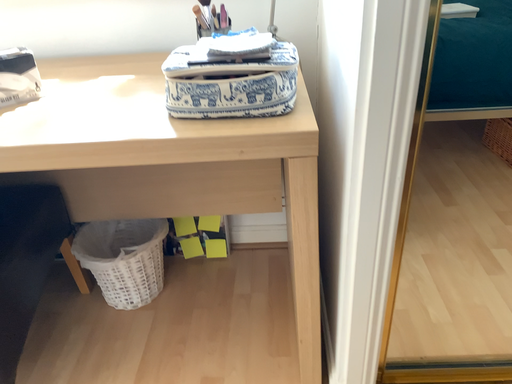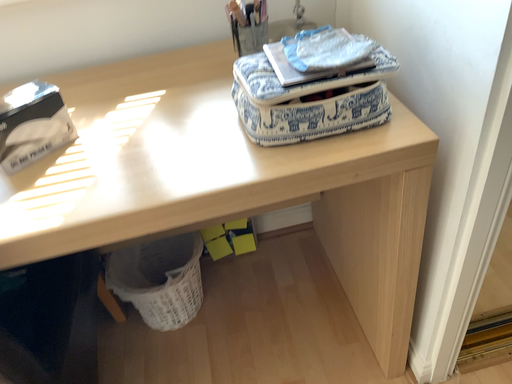
Question: How did the camera likely rotate when shooting the video?

Choices:
 (A) rotated right
 (B) rotated left

Answer: (A)